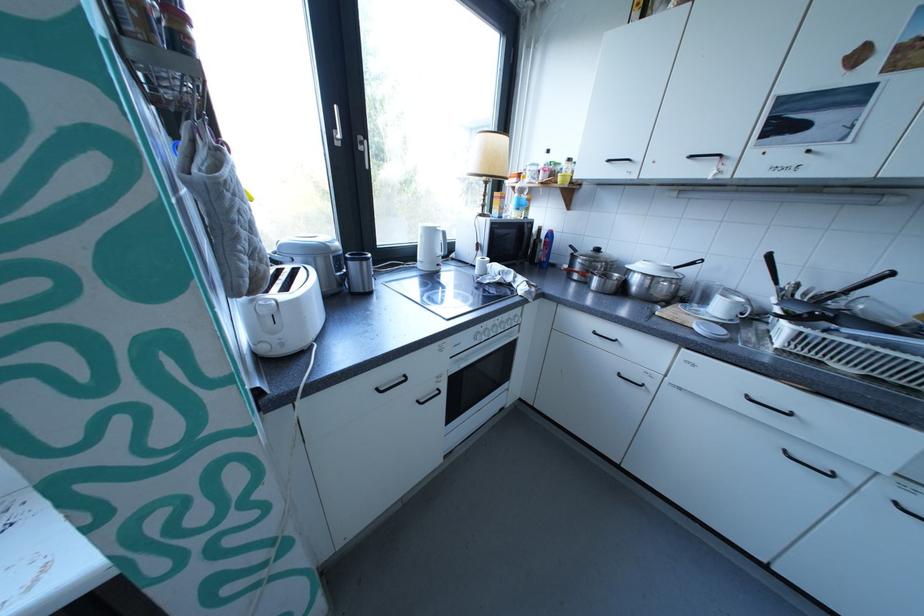
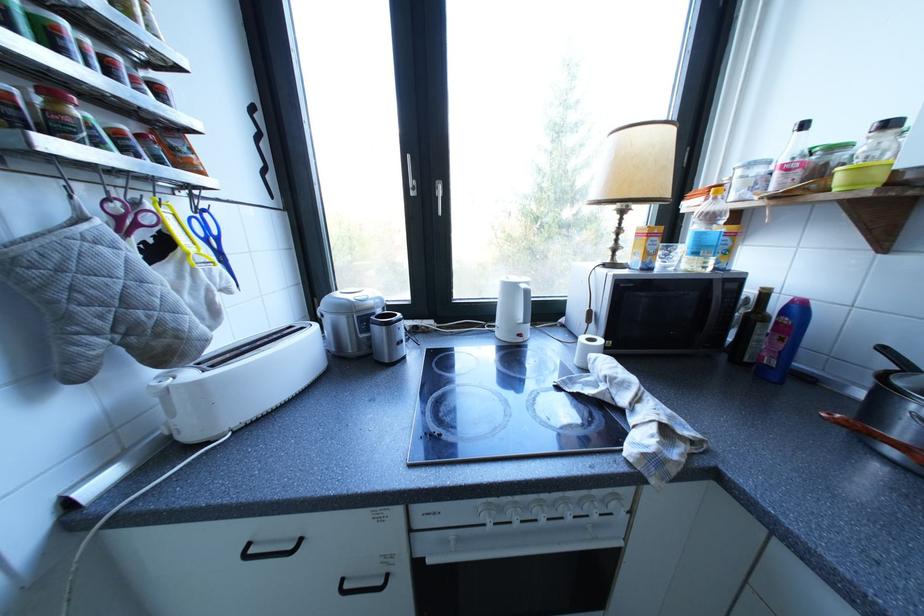
Where in the second image is the point corresponding to point (536, 233) from the first image?

(723, 301)